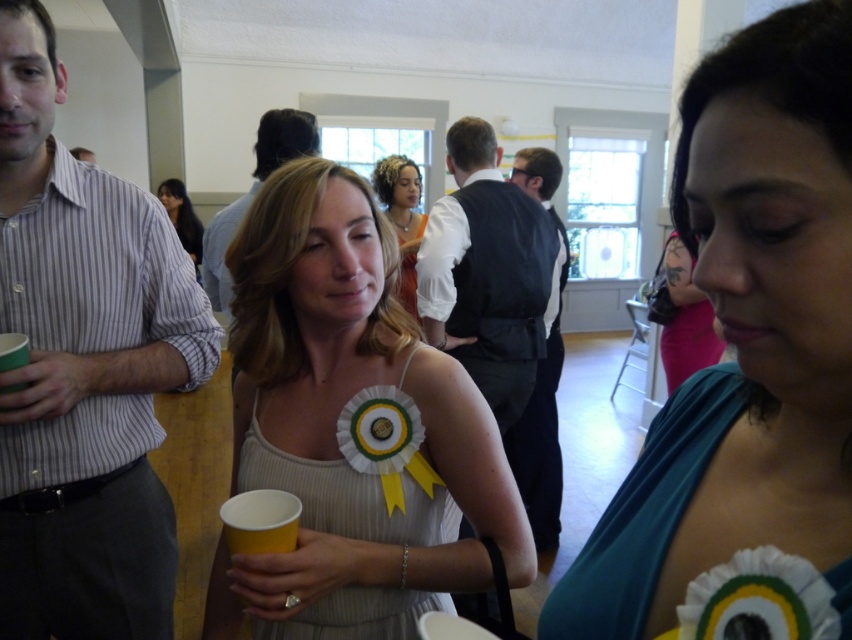
Does dark blue vest at center appear under shiny gold necklace at center?

Yes, dark blue vest at center is below shiny gold necklace at center.

Is point (557, 531) positioned in front of point (395, 173)?

That is True.

Image resolution: width=852 pixels, height=640 pixels. I want to click on dark blue vest at center, so click(540, 378).

In the scene shown: Is striped cotton shirt at left taller than matte white shirt at center?

Yes.

Who is more forward, [72,189] or [228,289]?

Point [72,189] is more forward.

At what (x,y) coordinates should I click in order to perform the action: click on striped cotton shirt at left. Please return your answer as a coordinate pair (x, y). Looking at the image, I should click on (83, 369).

Is white fabric dress at center closer to camera compared to matte black hair at upper left?

That is True.

Does white fabric dress at center come behind matte black hair at upper left?

No.

Which is in front, point (269, 486) or point (171, 182)?

Point (269, 486) is in front.

Locate an element on the screen. This screenshot has width=852, height=640. white fabric dress at center is located at coordinates (350, 428).